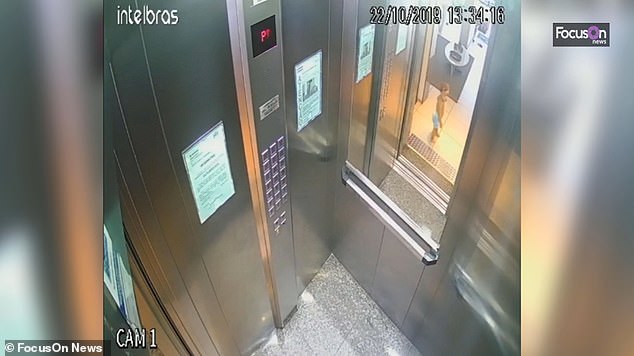
I want to click on floor, so click(375, 327).